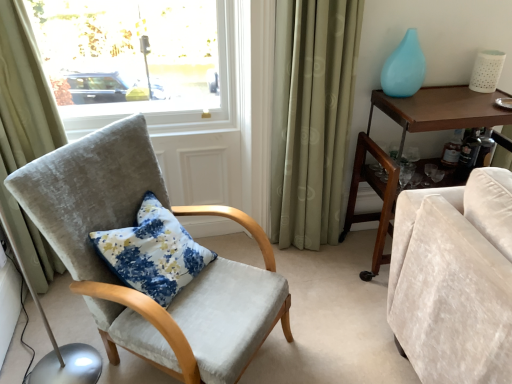
Question: From a real-world perspective, does beige fabric curtain at left, which is the first curtain from left to right, sit lower than brown wood desk at right?

Choices:
 (A) no
 (B) yes

Answer: (A)

Question: Is beige fabric curtain at left, which is the first curtain from left to right, positioned far away from brown wood desk at right?

Choices:
 (A) yes
 (B) no

Answer: (A)

Question: Considering the relative sizes of beige fabric curtain at left, arranged as the 2th curtain when viewed from the right, and brown wood desk at right in the image provided, is beige fabric curtain at left, arranged as the 2th curtain when viewed from the right, smaller than brown wood desk at right?

Choices:
 (A) yes
 (B) no

Answer: (A)

Question: Considering the relative positions of beige fabric curtain at left, which is the first curtain from left to right, and brown wood desk at right in the image provided, is beige fabric curtain at left, which is the first curtain from left to right, to the left of brown wood desk at right from the viewer's perspective?

Choices:
 (A) no
 (B) yes

Answer: (B)

Question: Can you confirm if beige fabric curtain at left, arranged as the 2th curtain when viewed from the right, is thinner than brown wood desk at right?

Choices:
 (A) yes
 (B) no

Answer: (A)

Question: From their relative heights in the image, would you say velvet cushioned chair at left is taller or shorter than brown wood desk at right?

Choices:
 (A) tall
 (B) short

Answer: (A)

Question: From a real-world perspective, is velvet cushioned chair at left physically located above or below brown wood desk at right?

Choices:
 (A) above
 (B) below

Answer: (A)

Question: Which is correct: velvet cushioned chair at left is inside brown wood desk at right, or outside of it?

Choices:
 (A) inside
 (B) outside

Answer: (B)

Question: Is velvet cushioned chair at left bigger or smaller than brown wood desk at right?

Choices:
 (A) big
 (B) small

Answer: (A)

Question: Is point [x=29, y=160] positioned closer to the camera than point [x=32, y=188]?

Choices:
 (A) closer
 (B) farther

Answer: (B)

Question: From a real-world perspective, is beige fabric curtain at left, which is the first curtain from left to right, physically located above or below velvet cushioned chair at left?

Choices:
 (A) above
 (B) below

Answer: (A)

Question: Based on their sizes in the image, would you say beige fabric curtain at left, arranged as the 2th curtain when viewed from the right, is bigger or smaller than velvet cushioned chair at left?

Choices:
 (A) small
 (B) big

Answer: (A)

Question: From their relative heights in the image, would you say beige fabric curtain at left, which is the first curtain from left to right, is taller or shorter than velvet cushioned chair at left?

Choices:
 (A) tall
 (B) short

Answer: (A)

Question: From a real-world perspective, is beige fabric curtain at left, which is the first curtain from left to right, above or below brown wood desk at right?

Choices:
 (A) below
 (B) above

Answer: (B)

Question: Is point (16, 235) closer or farther from the camera than point (355, 152)?

Choices:
 (A) closer
 (B) farther

Answer: (A)